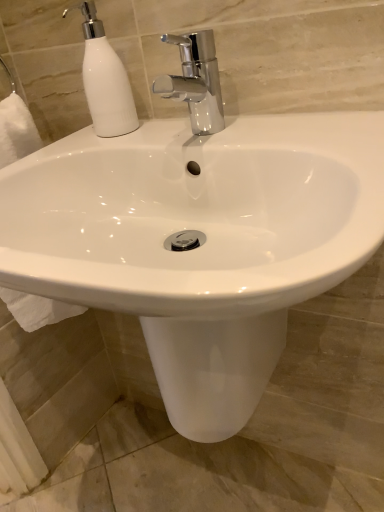
Find the location of a particular element. This screenshot has height=512, width=384. vacant space in front of white matte soap dispenser at upper left is located at coordinates (125, 142).